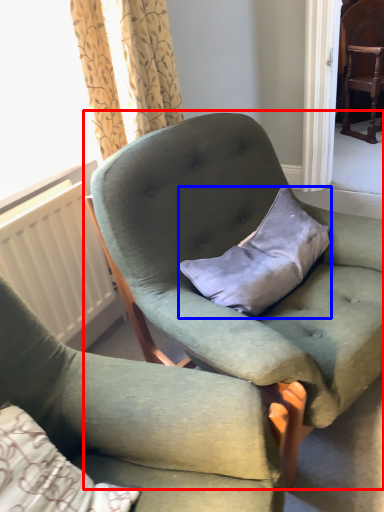
Question: Which point is further to the camera, chair (highlighted by a red box) or pillow (highlighted by a blue box)?

Choices:
 (A) chair
 (B) pillow

Answer: (B)